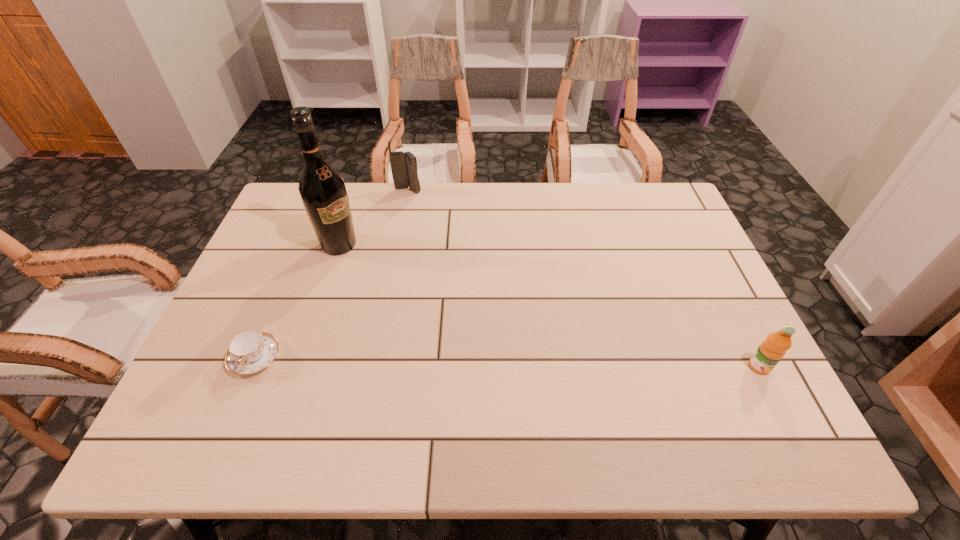
The height and width of the screenshot is (540, 960). What are the coordinates of `free space between the third nearest object and the shortest object` in the screenshot? It's located at (298, 301).

Find the location of a particular element. vacant space in between the third tallest object and the third shortest object is located at coordinates (584, 279).

Find the location of `blank region between the orange juice and the shortest object`. blank region between the orange juice and the shortest object is located at coordinates (508, 362).

At what (x,y) coordinates should I click in order to perform the action: click on vacant area that lies between the farthest object and the orange juice. Please return your answer as a coordinate pair (x, y). Looking at the image, I should click on (584, 279).

What are the coordinates of `vacant space in between the third nearest object and the orange juice` in the screenshot? It's located at (549, 306).

The height and width of the screenshot is (540, 960). I want to click on empty space between the shortest object and the tallest object, so click(x=298, y=301).

Where is `vacant area between the third object from left to right and the shortest object`? The width and height of the screenshot is (960, 540). vacant area between the third object from left to right and the shortest object is located at coordinates (331, 274).

You are a GUI agent. You are given a task and a screenshot of the screen. Output one action in this format:
    pyautogui.click(x=<x>, y=<y>)
    Task: Click on the object that stands as the second closest to the third tallest object
    The width and height of the screenshot is (960, 540).
    Given the screenshot: What is the action you would take?
    pyautogui.click(x=403, y=164)

The image size is (960, 540). Identify the location of object that can be found as the second closest to the farthest object. (250, 351).